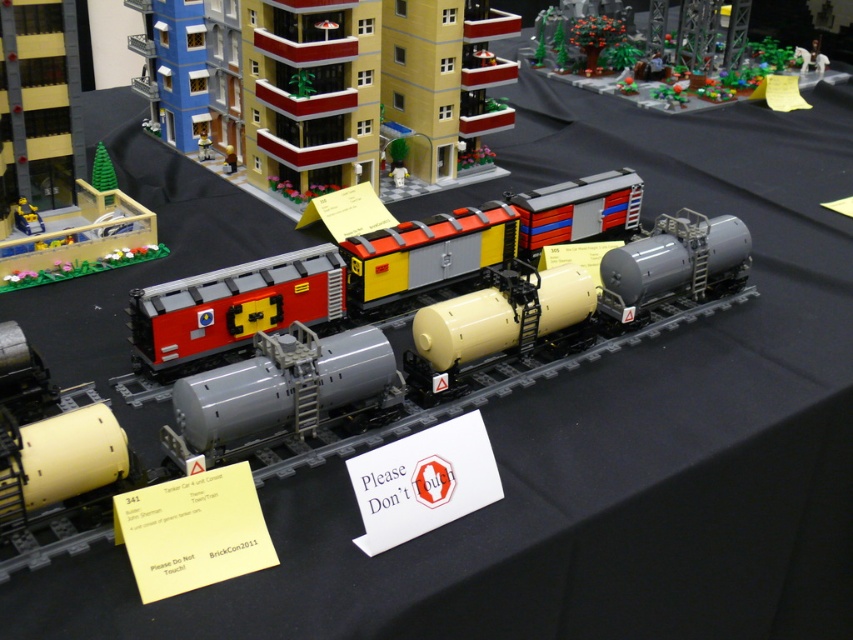
You are standing in front of the Lego train set and want to place a small Lego figure between the two points, point (x=27, y=212) and point (x=224, y=150). Which point should you place the figure closer to if you want it to be nearer to you?

You should place the figure closer to point (x=27, y=212) because it is already closer to the viewer than point (x=224, y=150).

You are a toy engineer who needs to place a new toy car that is 10 inches long between the matte black train car at left and the matte gray train car at center. Can the toy car fit in the space between them?

The matte black train car at left is 16.92 inches away from the matte gray train car at center. Since the toy car is 10 inches long, there is enough space between them for the toy car to fit.

You are a photographer trying to capture the Lego train set. You notice two points in the scene labeled as point (90, 240) and point (637, 17). Which point should you focus on to ensure it appears clearer in your photo?

Point (90, 240) is closer to the camera than point (637, 17), so focusing on point (90, 240) will make it appear clearer in the photo.